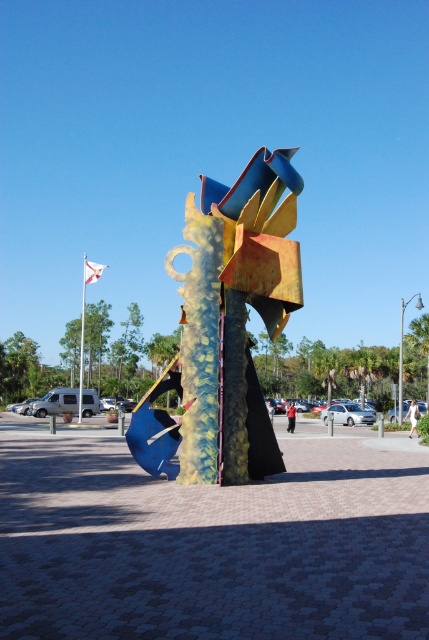
Question: From the image, what is the correct spatial relationship of metallic blue and yellow abstract sculpture at center in relation to white flagpole at upper left?

Choices:
 (A) above
 (B) below

Answer: (B)

Question: Based on their relative distances, which object is nearer to the metallic pole at center?

Choices:
 (A) metallic blue and yellow abstract sculpture at center
 (B) white flagpole at upper left

Answer: (B)

Question: Among these objects, which one is farthest from the camera?

Choices:
 (A) metallic pole at center
 (B) metallic blue and yellow abstract sculpture at center
 (C) white flagpole at upper left

Answer: (A)

Question: Which object is closer to the camera taking this photo?

Choices:
 (A) white flagpole at upper left
 (B) metallic pole at center
 (C) metallic blue and yellow abstract sculpture at center

Answer: (C)

Question: Does white flagpole at upper left have a greater width compared to metallic pole at center?

Choices:
 (A) yes
 (B) no

Answer: (A)

Question: Is metallic blue and yellow abstract sculpture at center bigger than metallic pole at center?

Choices:
 (A) no
 (B) yes

Answer: (A)